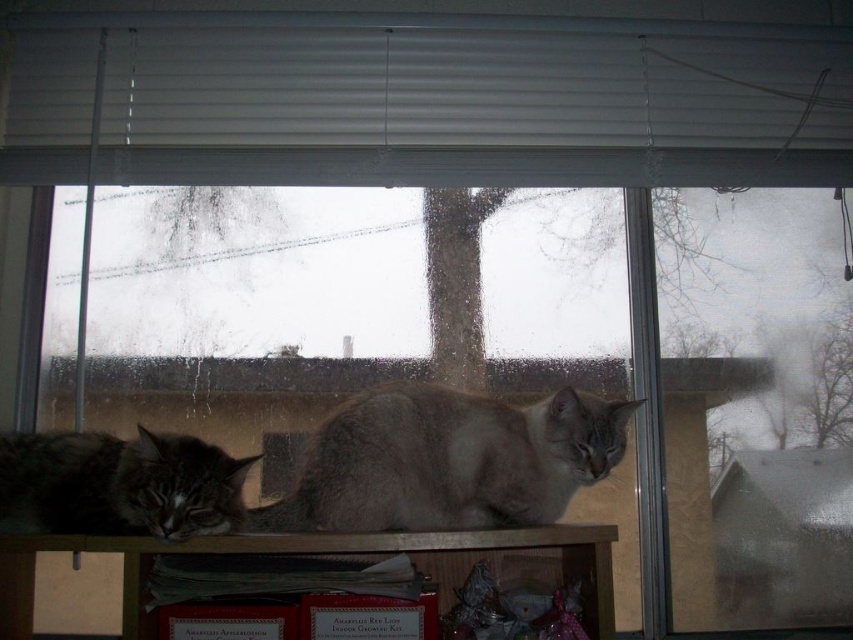
Which is more to the right, white matte blinds at upper center or gray fluffy cat at lower left?

From the viewer's perspective, white matte blinds at upper center appears more on the right side.

Is white matte blinds at upper center behind gray fluffy cat at lower left?

Yes, white matte blinds at upper center is behind gray fluffy cat at lower left.

Does point (248, 56) lie in front of point (73, 456)?

No.

The width and height of the screenshot is (853, 640). I want to click on white matte blinds at upper center, so click(x=466, y=88).

Identify the location of gray fur cat at center. This screenshot has height=640, width=853. (447, 461).

Is gray fur cat at center behind gray fluffy cat at lower left?

Yes.

Who is more forward, (358, 512) or (44, 464)?

Point (358, 512) is more forward.

In order to click on gray fur cat at center in this screenshot , I will do `click(447, 461)`.

Describe the element at coordinates (119, 484) in the screenshot. I see `gray fluffy cat at lower left` at that location.

Is gray fluffy cat at lower left thinner than wooden shelf at lower center?

Yes, gray fluffy cat at lower left is thinner than wooden shelf at lower center.

Who is more forward, (158, 480) or (3, 614)?

Positioned in front is point (158, 480).

The height and width of the screenshot is (640, 853). I want to click on gray fluffy cat at lower left, so click(119, 484).